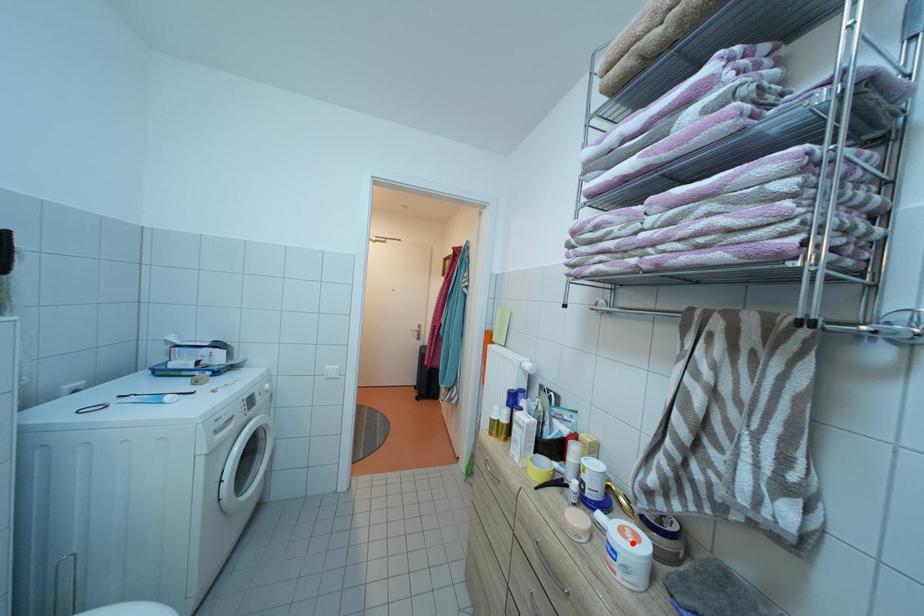
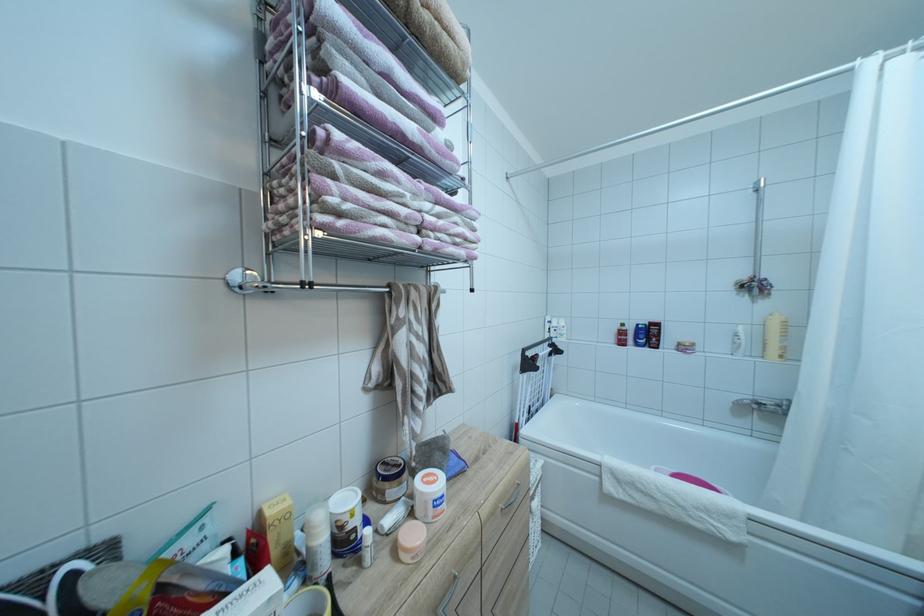
Locate, in the second image, the point that corresponds to the highlighted location in the first image.

(442, 487)